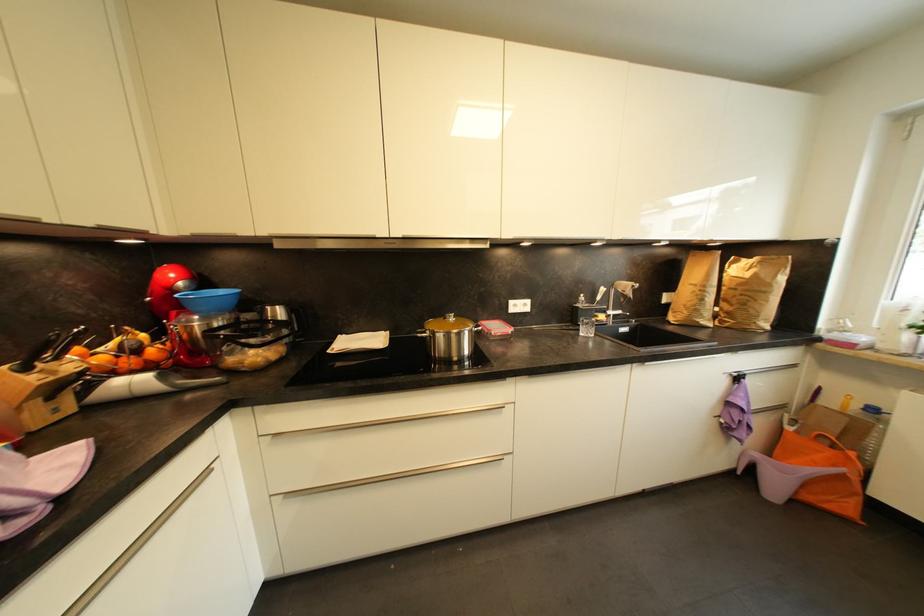
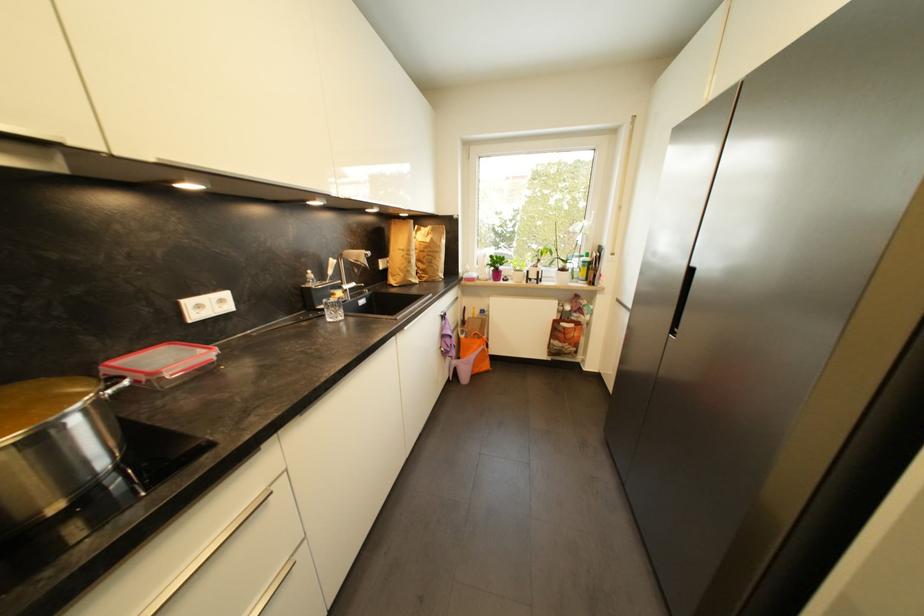
The point at (530, 306) is marked in the first image. Where is the corresponding point in the second image?

(226, 302)